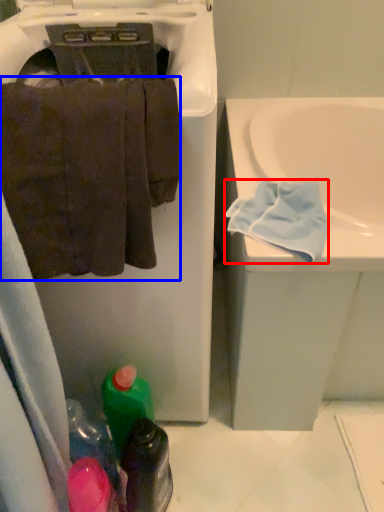
Question: Which of the following is the closest to the observer, bath towel (highlighted by a red box) or towel (highlighted by a blue box)?

Choices:
 (A) bath towel
 (B) towel

Answer: (B)